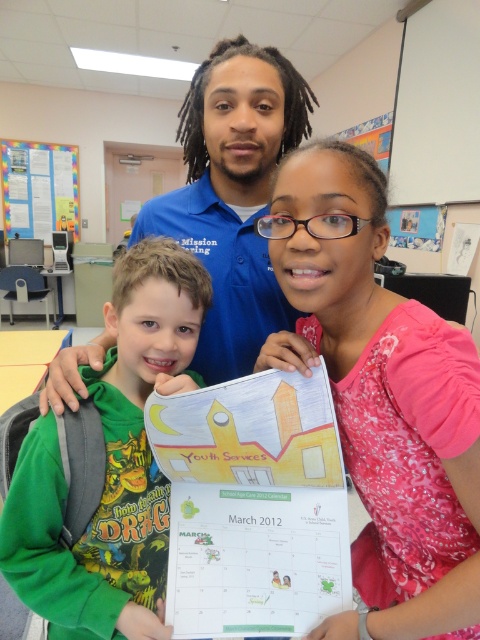
How distant is blue cotton shirt at center from white matte projector screen at upper right?

blue cotton shirt at center and white matte projector screen at upper right are 4.82 feet apart.

Who is taller, blue cotton shirt at center or white matte projector screen at upper right?

white matte projector screen at upper right is taller.

Is point (267, 138) positioned behind point (441, 13)?

No.

At what (x,y) coordinates should I click in order to perform the action: click on blue cotton shirt at center. Please return your answer as a coordinate pair (x, y). The width and height of the screenshot is (480, 640). Looking at the image, I should click on (232, 195).

Does pink floral dress at center appear under blue cotton shirt at center?

Yes, pink floral dress at center is below blue cotton shirt at center.

Is pink floral dress at center to the right of blue cotton shirt at center from the viewer's perspective?

Correct, you'll find pink floral dress at center to the right of blue cotton shirt at center.

At what (x,y) coordinates should I click in order to perform the action: click on pink floral dress at center. Please return your answer as a coordinate pair (x, y). Looking at the image, I should click on (383, 392).

Does pink floral dress at center appear on the left side of green cotton shirt at left?

Incorrect, pink floral dress at center is not on the left side of green cotton shirt at left.

Who is lower down, pink floral dress at center or green cotton shirt at left?

green cotton shirt at left is below.

Image resolution: width=480 pixels, height=640 pixels. What do you see at coordinates (383, 392) in the screenshot? I see `pink floral dress at center` at bounding box center [383, 392].

I want to click on pink floral dress at center, so click(x=383, y=392).